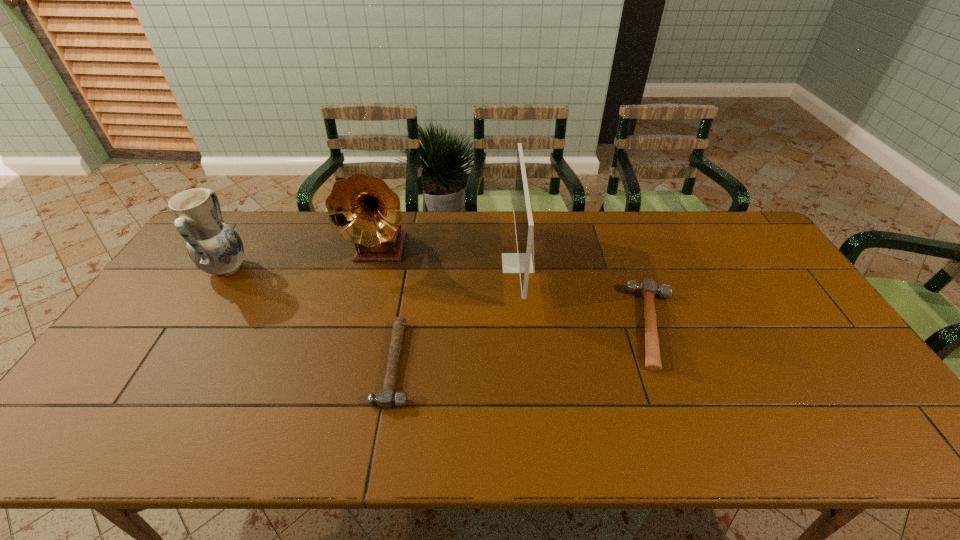
Where is `phonograph_record`? phonograph_record is located at coordinates (364, 210).

Identify the location of the fourth object from left to right. (522, 262).

This screenshot has height=540, width=960. What are the coordinates of `pottery` in the screenshot? It's located at (214, 247).

Locate an element on the screen. The image size is (960, 540). the rightmost object is located at coordinates (648, 288).

Where is `the right hammer`? The width and height of the screenshot is (960, 540). the right hammer is located at coordinates (648, 288).

This screenshot has width=960, height=540. I want to click on the shorter hammer, so click(x=385, y=399).

The height and width of the screenshot is (540, 960). In order to click on the shortest object in this screenshot , I will do `click(385, 399)`.

I want to click on vacant space located on the horn of the phonograph_record, so click(x=356, y=343).

Find the location of a particular element. free space located on the front-facing side of the fourth object from left to right is located at coordinates (453, 263).

The width and height of the screenshot is (960, 540). I want to click on vacant space located on the front-facing side of the fourth object from left to right, so click(474, 263).